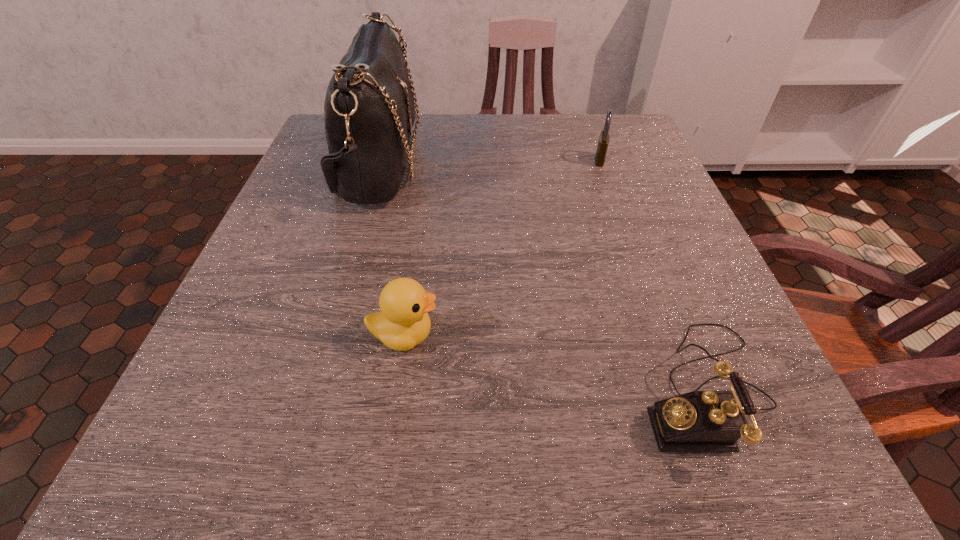
You are a GUI agent. You are given a task and a screenshot of the screen. Output one action in this format:
    pyautogui.click(x=<x>, y=<y>)
    Task: Click on the handbag that is at the far edge
    The height and width of the screenshot is (540, 960).
    Given the screenshot: What is the action you would take?
    click(369, 109)

In order to click on padlock that is at the far edge in this screenshot , I will do point(603,142).

This screenshot has height=540, width=960. In order to click on object that is at the near edge in this screenshot , I will do `click(699, 421)`.

The height and width of the screenshot is (540, 960). Find the location of `object that is at the left edge`. object that is at the left edge is located at coordinates tap(369, 109).

Locate an element on the screen. The width and height of the screenshot is (960, 540). padlock at the right edge is located at coordinates (603, 142).

Where is `telephone at the right edge`? Image resolution: width=960 pixels, height=540 pixels. telephone at the right edge is located at coordinates (699, 421).

Locate an element on the screen. This screenshot has height=540, width=960. object that is at the far left corner is located at coordinates (369, 109).

Find the location of a particular element. object located in the far right corner section of the desktop is located at coordinates [x=603, y=142].

In order to click on object present at the near right corner in this screenshot , I will do `click(699, 421)`.

In the image, there is a desktop. At what (x,y) coordinates should I click in order to perform the action: click on free space at the far edge. Please return your answer as a coordinate pair (x, y). Looking at the image, I should click on (528, 148).